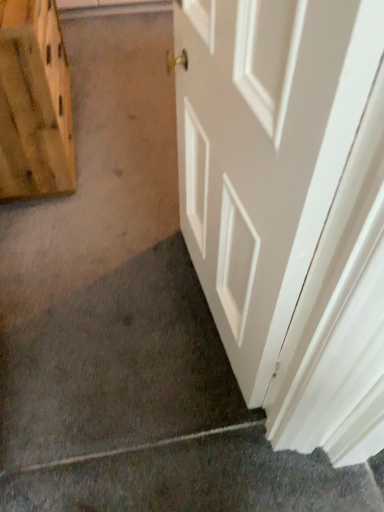
Question: Does white glossy door at center have a greater width compared to wooden plank at left?

Choices:
 (A) yes
 (B) no

Answer: (B)

Question: Does white glossy door at center have a smaller size compared to wooden plank at left?

Choices:
 (A) no
 (B) yes

Answer: (B)

Question: From a real-world perspective, does white glossy door at center stand above wooden plank at left?

Choices:
 (A) yes
 (B) no

Answer: (A)

Question: Is white glossy door at center thinner than wooden plank at left?

Choices:
 (A) yes
 (B) no

Answer: (A)

Question: Can you confirm if white glossy door at center is taller than wooden plank at left?

Choices:
 (A) yes
 (B) no

Answer: (A)

Question: Considering the relative positions of gray matte concrete at lower left and wooden plank at left in the image provided, is gray matte concrete at lower left to the left or to the right of wooden plank at left?

Choices:
 (A) right
 (B) left

Answer: (A)

Question: Considering the positions of gray matte concrete at lower left and wooden plank at left in the image, is gray matte concrete at lower left wider or thinner than wooden plank at left?

Choices:
 (A) wide
 (B) thin

Answer: (B)

Question: In terms of size, does gray matte concrete at lower left appear bigger or smaller than wooden plank at left?

Choices:
 (A) small
 (B) big

Answer: (A)

Question: From the image's perspective, relative to wooden plank at left, is gray matte concrete at lower left above or below?

Choices:
 (A) above
 (B) below

Answer: (B)

Question: Which is correct: white glossy door at center is inside gray matte concrete at lower left, or outside of it?

Choices:
 (A) inside
 (B) outside

Answer: (B)

Question: Is white glossy door at center to the left or to the right of gray matte concrete at lower left in the image?

Choices:
 (A) left
 (B) right

Answer: (B)

Question: From a real-world perspective, is white glossy door at center above or below gray matte concrete at lower left?

Choices:
 (A) below
 (B) above

Answer: (B)

Question: Is white glossy door at center in front of or behind gray matte concrete at lower left in the image?

Choices:
 (A) front
 (B) behind

Answer: (A)

Question: Is point (289, 188) closer or farther from the camera than point (69, 177)?

Choices:
 (A) closer
 (B) farther

Answer: (A)

Question: From a real-world perspective, is white glossy door at center positioned above or below wooden plank at left?

Choices:
 (A) above
 (B) below

Answer: (A)